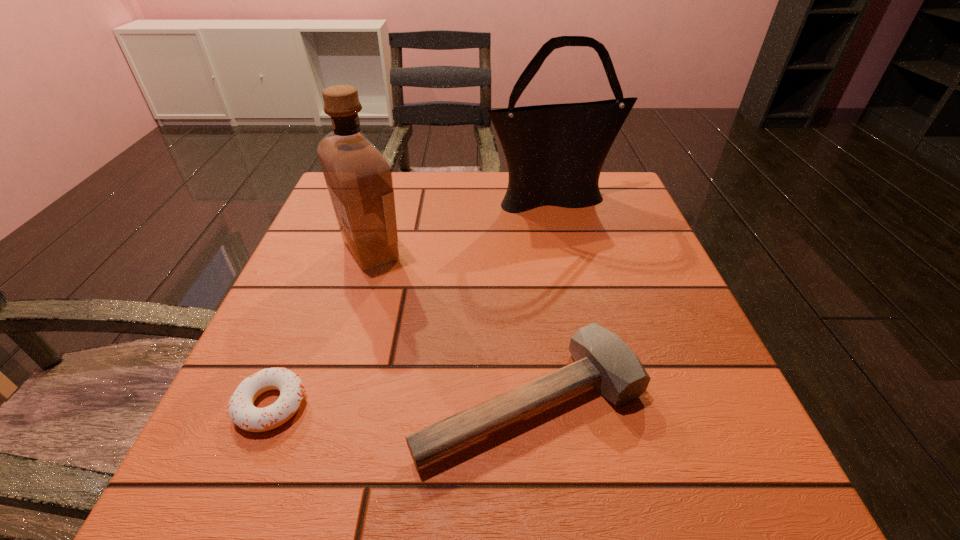
At what (x,y) coordinates should I click in order to perform the action: click on shoulder bag. Please return your answer as a coordinate pair (x, y). Looking at the image, I should click on (555, 153).

Where is `liquor`? liquor is located at coordinates (358, 176).

This screenshot has width=960, height=540. I want to click on the second shortest object, so click(602, 360).

Locate an element on the screen. doughnut is located at coordinates (242, 412).

Locate an element on the screen. This screenshot has height=540, width=960. free space located on the front of the shoulder bag is located at coordinates (582, 313).

The height and width of the screenshot is (540, 960). Find the location of `vacant space located on the front-facing side of the second farthest object`. vacant space located on the front-facing side of the second farthest object is located at coordinates (480, 251).

I want to click on vacant area situated 0.310m on the back of the mallet, so click(x=514, y=233).

Locate an element on the screen. The height and width of the screenshot is (540, 960). free spot located 0.080m on the right of the doughnut is located at coordinates (362, 405).

Identify the location of object located in the far edge section of the desktop. The width and height of the screenshot is (960, 540). (555, 153).

I want to click on object located at the near edge, so click(x=602, y=360).